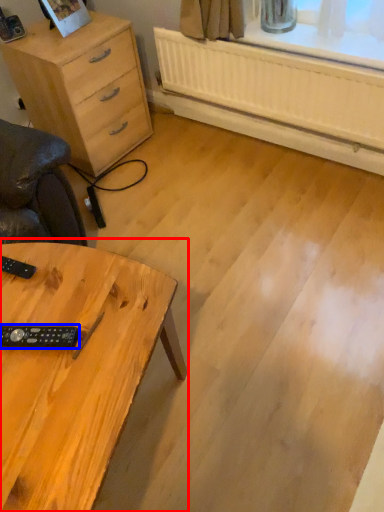
Question: Which point is closer to the camera, table (highlighted by a red box) or control (highlighted by a blue box)?

Choices:
 (A) table
 (B) control

Answer: (A)